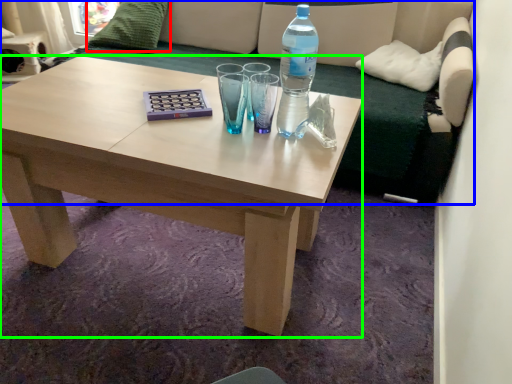
Question: Considering the real-world distances, which object is farthest from pillow (highlighted by a red box)? studio couch (highlighted by a blue box) or coffee table (highlighted by a green box)?

Choices:
 (A) studio couch
 (B) coffee table

Answer: (B)